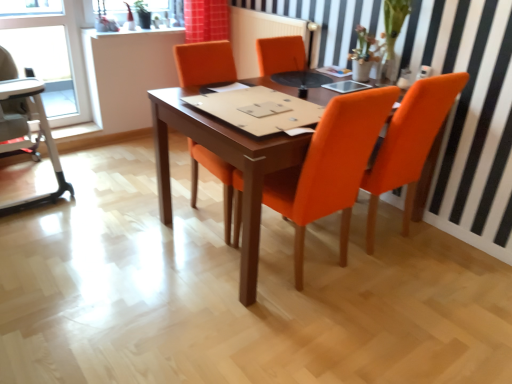
Find the location of a particular element. vacant area that lies in front of orange fabric chair at right, which is the 2th chair in left-to-right order is located at coordinates (408, 297).